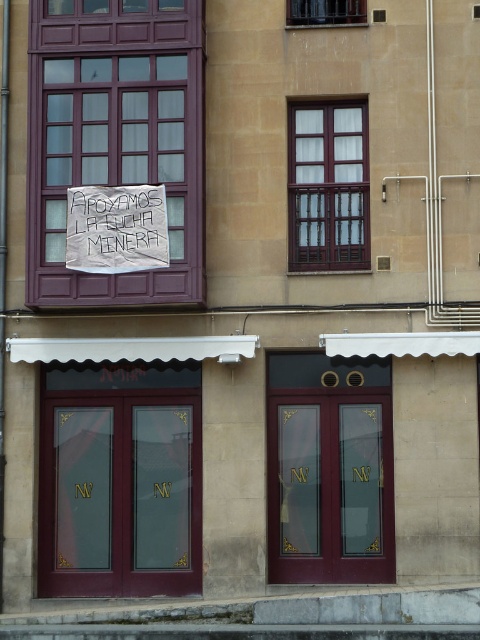
Can you confirm if matte purple window at upper left is positioned below matte burgundy door at center?

Incorrect, matte purple window at upper left is not positioned below matte burgundy door at center.

This screenshot has height=640, width=480. What are the coordinates of `matte purple window at upper left` in the screenshot? It's located at (115, 138).

Can you confirm if wooden window at center is smaller than white paper sign at upper center?

No, wooden window at center is not smaller than white paper sign at upper center.

Does point (291, 234) come closer to viewer compared to point (107, 260)?

No.

Identify the location of wooden window at center. (327, 186).

Between matte purple window at upper left and white paper sign at upper center, which one has less height?

white paper sign at upper center

Can you confirm if matte purple window at upper left is taller than white paper sign at upper center?

Indeed, matte purple window at upper left has a greater height compared to white paper sign at upper center.

Identify the location of matte purple window at upper left. The height and width of the screenshot is (640, 480). (115, 138).

At what (x,y) coordinates should I click in order to perform the action: click on matte purple window at upper left. Please return your answer as a coordinate pair (x, y). Looking at the image, I should click on (115, 138).